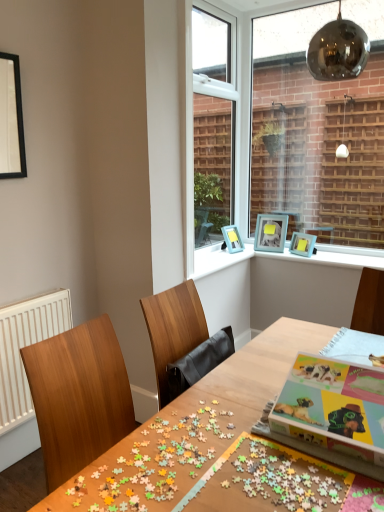
Question: Does blue plastic picture frames at upper center have a lesser height compared to white radiator at left?

Choices:
 (A) yes
 (B) no

Answer: (A)

Question: Is blue plastic picture frames at upper center not near white radiator at left?

Choices:
 (A) no
 (B) yes

Answer: (B)

Question: Does blue plastic picture frames at upper center have a greater width compared to white radiator at left?

Choices:
 (A) yes
 (B) no

Answer: (A)

Question: From a real-world perspective, is blue plastic picture frames at upper center under white radiator at left?

Choices:
 (A) yes
 (B) no

Answer: (B)

Question: Is blue plastic picture frames at upper center facing towards white radiator at left?

Choices:
 (A) no
 (B) yes

Answer: (A)

Question: Is multicolored puzzle pieces at center spatially inside black matte picture frame at upper left, which is the 1th picture frame from front to back, or outside of it?

Choices:
 (A) inside
 (B) outside

Answer: (B)

Question: In the image, is multicolored puzzle pieces at center positioned in front of or behind black matte picture frame at upper left, the fourth picture frame positioned from the right?

Choices:
 (A) front
 (B) behind

Answer: (A)

Question: From a real-world perspective, is multicolored puzzle pieces at center positioned above or below black matte picture frame at upper left, which is the 1th picture frame from front to back?

Choices:
 (A) above
 (B) below

Answer: (B)

Question: In terms of height, does multicolored puzzle pieces at center look taller or shorter compared to black matte picture frame at upper left, which is counted as the first picture frame, starting from the left?

Choices:
 (A) short
 (B) tall

Answer: (A)

Question: Based on their positions, is teal matte picture frame at upper right, positioned as the 3th picture frame in front-to-back order, located to the left or right of blue plastic picture frames at upper center?

Choices:
 (A) left
 (B) right

Answer: (A)

Question: From their relative heights in the image, would you say teal matte picture frame at upper right, the 2th picture frame from the back, is taller or shorter than blue plastic picture frames at upper center?

Choices:
 (A) short
 (B) tall

Answer: (B)

Question: In the image, is teal matte picture frame at upper right, the 3th picture frame when ordered from right to left, positioned in front of or behind blue plastic picture frames at upper center?

Choices:
 (A) front
 (B) behind

Answer: (B)

Question: From the image's perspective, is teal matte picture frame at upper right, the 3th picture frame when ordered from right to left, located above or below blue plastic picture frames at upper center?

Choices:
 (A) above
 (B) below

Answer: (A)

Question: In terms of width, does teal matte picture frame at upper right, the 1th picture frame from the back, look wider or thinner when compared to black matte picture frame at upper left, which is the 1th picture frame from front to back?

Choices:
 (A) wide
 (B) thin

Answer: (A)

Question: Which is correct: teal matte picture frame at upper right, the 1th picture frame from the back, is inside black matte picture frame at upper left, the 4th picture frame positioned from the back, or outside of it?

Choices:
 (A) outside
 (B) inside

Answer: (A)